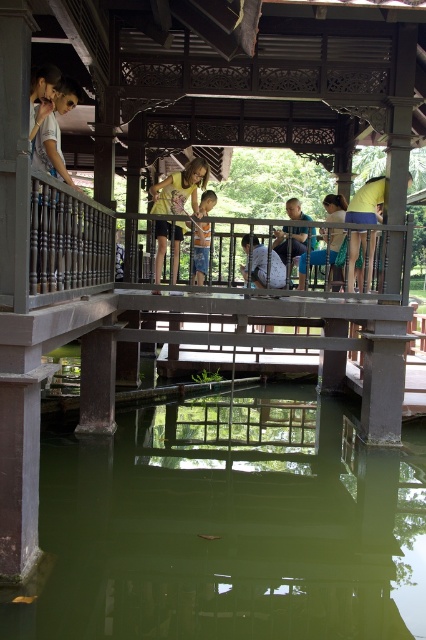
Question: Is green translucent water at center smaller than light brown fabric shirt at upper left?

Choices:
 (A) no
 (B) yes

Answer: (B)

Question: Among these points, which one is farthest from the camera?

Choices:
 (A) (342, 236)
 (B) (353, 220)
 (C) (287, 237)
 (D) (276, 259)

Answer: (A)

Question: Does yellow fabric bag at center appear under blue denim shorts at center?

Choices:
 (A) yes
 (B) no

Answer: (B)

Question: Which object is positioned farthest from the yellow matte shirt at center?

Choices:
 (A) light blue denim shorts at center
 (B) green translucent water at center
 (C) green fabric shirt at center
 (D) light brown wooden child at center

Answer: (B)

Question: Which point is farther to the camera?

Choices:
 (A) (34, 90)
 (B) (184, 179)
 (C) (193, 272)
 (D) (340, 202)

Answer: (D)

Question: Can you confirm if green translucent water at center is positioned below blue denim shorts at center?

Choices:
 (A) no
 (B) yes

Answer: (B)